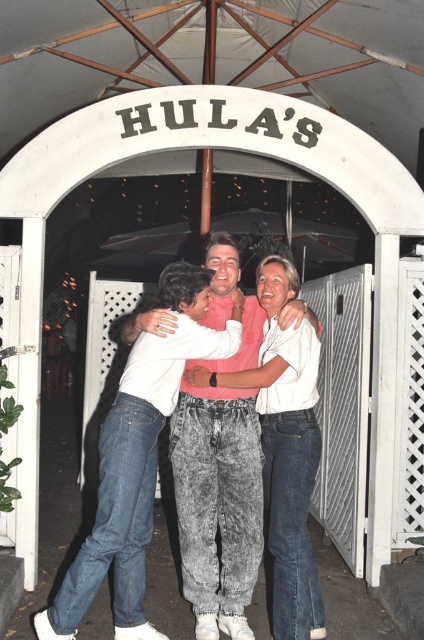
You are a photographer at the entrance of Hula. You notice a person wearing a white cotton shirt at center and denim pants at center. Which clothing item is positioned higher on their body?

The white cotton shirt at center is positioned higher on their body than the denim pants at center because it is above the denim pants at center.

You are a photographer at Hula venue and need to capture a group photo of the three people hugging. The camera you have can only focus on objects within a 3 feet range. The white cotton shirt at center and denim pants at center are both in the frame. Which one is closer to the camera?

The white cotton shirt at center is smaller than denim pants at center, so it is closer to the camera.